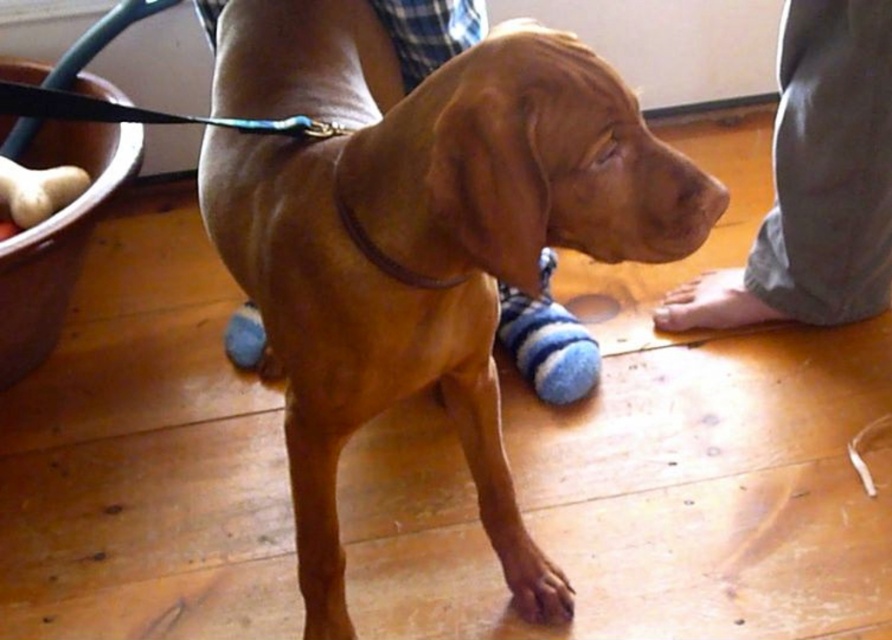
Question: Can you confirm if brown fur paw at lower right is thinner than brown smooth nose at center?

Choices:
 (A) no
 (B) yes

Answer: (A)

Question: Among these points, which one is farthest from the camera?

Choices:
 (A) (715, 195)
 (B) (541, 45)
 (C) (552, 564)

Answer: (C)

Question: Considering the relative positions of brown fur paw at lower right and brown fur paw at lower center in the image provided, where is brown fur paw at lower right located with respect to brown fur paw at lower center?

Choices:
 (A) right
 (B) left

Answer: (A)

Question: Is brown leather dog at center wider than brown fur paw at lower right?

Choices:
 (A) no
 (B) yes

Answer: (B)

Question: Which object is closer to the camera taking this photo?

Choices:
 (A) gray cotton pants at lower right
 (B) brown leather dog at center
 (C) brown smooth nose at center

Answer: (B)

Question: Which of the following is the farthest from the observer?

Choices:
 (A) (701, 193)
 (B) (548, 605)

Answer: (B)